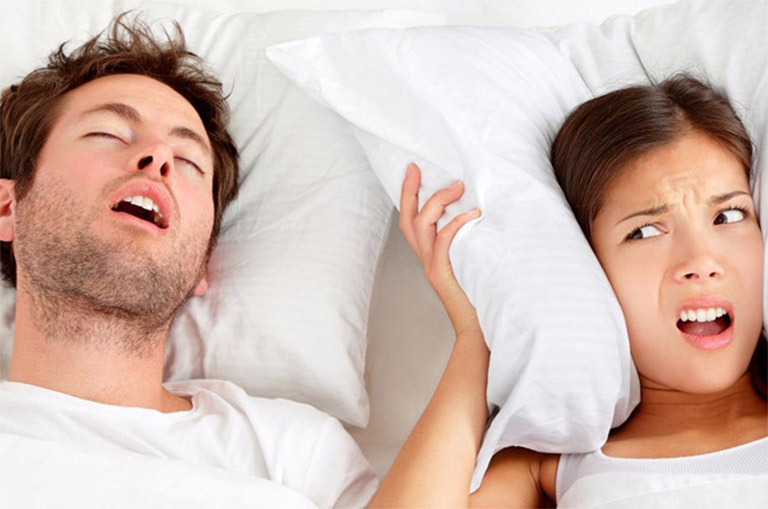
The width and height of the screenshot is (768, 509). What are the coordinates of `pillow` in the screenshot? It's located at pyautogui.click(x=273, y=234), pyautogui.click(x=435, y=127).